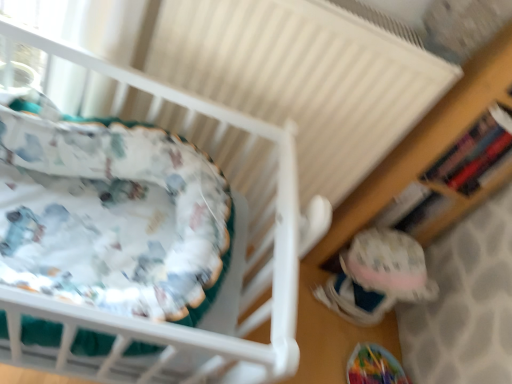
Question: Does point (51, 307) appear closer or farther from the camera than point (328, 44)?

Choices:
 (A) closer
 (B) farther

Answer: (A)

Question: Is white fabric infant bed at left to the left or to the right of white textured radiator at upper center in the image?

Choices:
 (A) right
 (B) left

Answer: (B)

Question: Based on their relative distances, which object is farther from the fuzzy fabric toy at lower right?

Choices:
 (A) wooden bookshelf at right
 (B) white textured radiator at upper center
 (C) white fabric infant bed at left

Answer: (B)

Question: Considering the real-world distances, which object is closest to the fuzzy fabric toy at lower right?

Choices:
 (A) white textured radiator at upper center
 (B) white fabric infant bed at left
 (C) wooden bookshelf at right

Answer: (C)